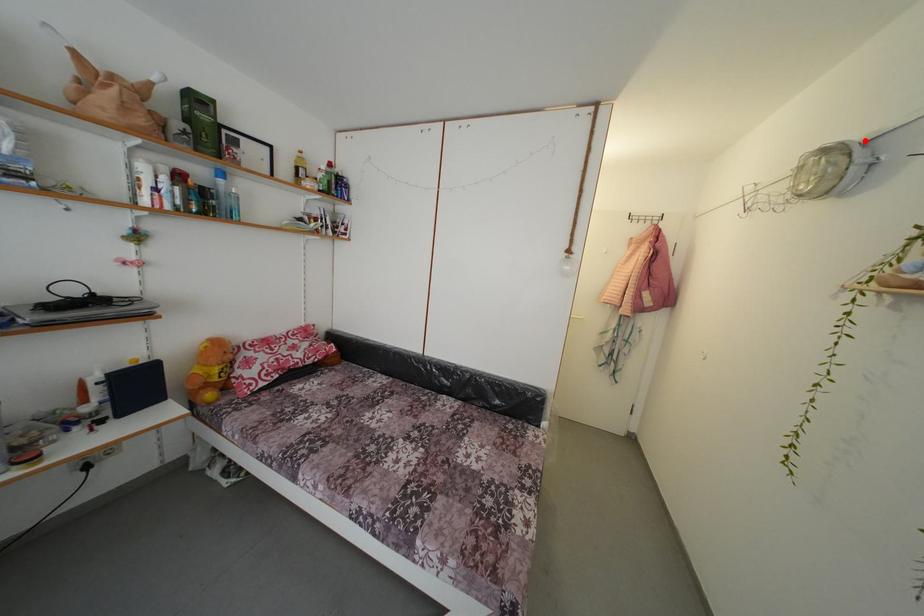
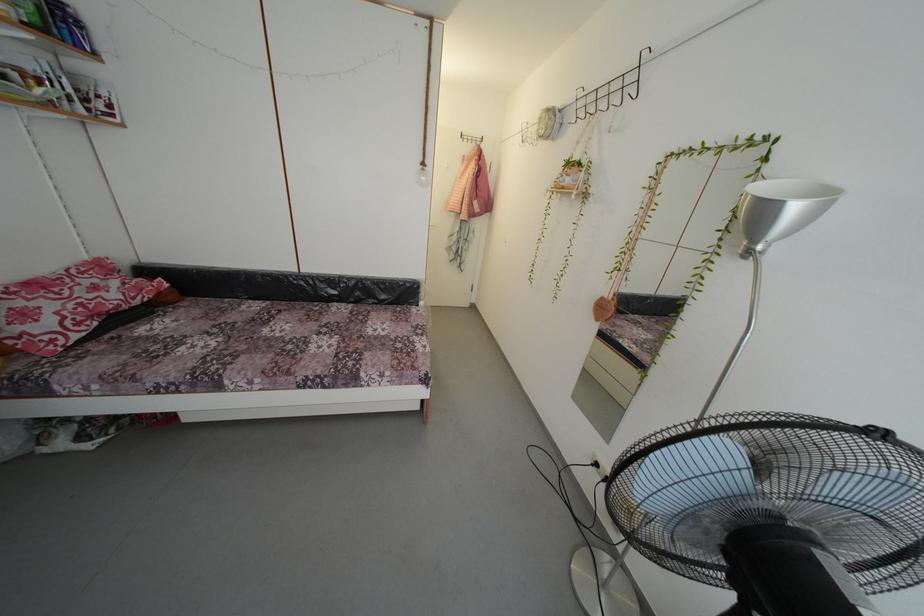
Question: I am providing you with two images of the same scene from different viewpoints. A red point is marked on the first image. At the location where the point appears in image 1, is it still visible in image 2?

Choices:
 (A) Yes
 (B) No

Answer: (A)